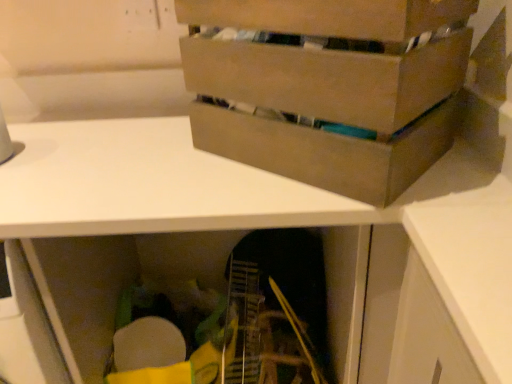
The height and width of the screenshot is (384, 512). What are the coordinates of `empty space that is ontop of white matte desk at center (from a real-world perspective)` in the screenshot? It's located at [x=161, y=156].